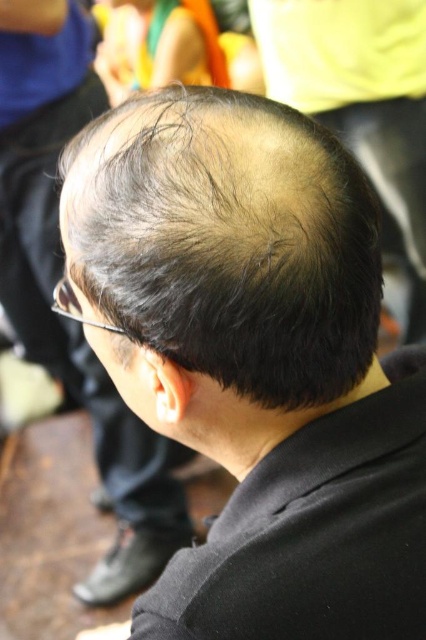
Does point (152, 108) come in front of point (0, 212)?

Yes, it is in front of point (0, 212).

Is dark brown hair at center thinner than dark brown hair at upper center?

Indeed, dark brown hair at center has a lesser width compared to dark brown hair at upper center.

Between point (232, 385) and point (80, 77), which one is positioned behind?

Point (80, 77)

This screenshot has height=640, width=426. Find the location of `dark brown hair at center`. dark brown hair at center is located at coordinates (227, 241).